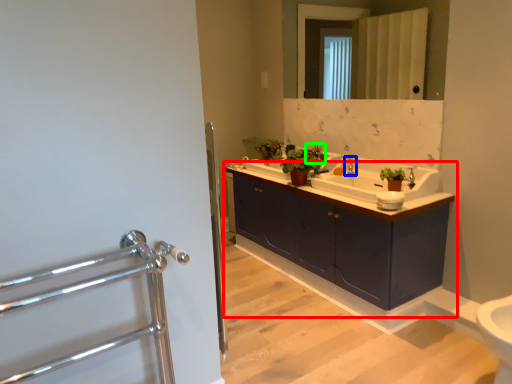
Question: Considering the real-world distances, which object is closest to bathroom cabinet (highlighted by a red box)? tap (highlighted by a blue box) or plant (highlighted by a green box).

Choices:
 (A) tap
 (B) plant

Answer: (A)